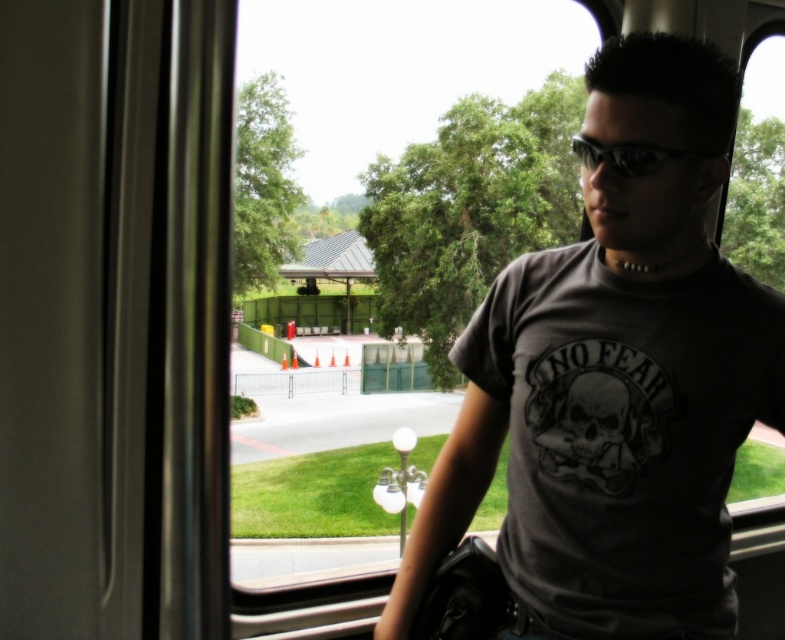
Does gray matte t-shirt at center have a larger size compared to sunglasses at center?

Correct, gray matte t-shirt at center is larger in size than sunglasses at center.

Which is in front, point (743, 353) or point (619, 168)?

Point (619, 168) is in front.

Find the location of a particular element. gray matte t-shirt at center is located at coordinates pos(615,381).